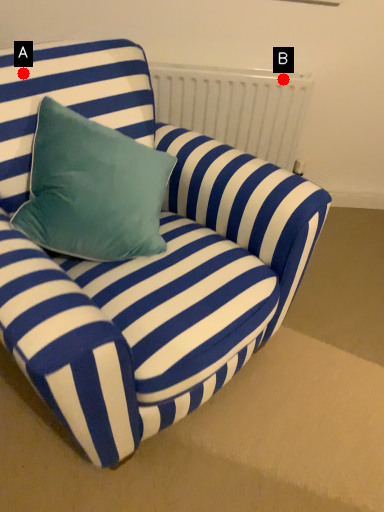
Question: Two points are circled on the image, labeled by A and B beside each circle. Which point appears closest to the camera in this image?

Choices:
 (A) A is closer
 (B) B is closer

Answer: (A)